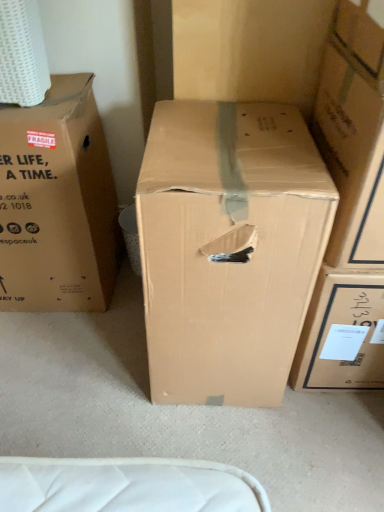
The width and height of the screenshot is (384, 512). Identify the location of brown cardboard box at center, which is the 2th box from right to left. (229, 248).

Identify the location of brown cardboard box at left, which is the 3th box from right to left. Image resolution: width=384 pixels, height=512 pixels. (57, 203).

The image size is (384, 512). What are the coordinates of `cardboard box at center, the 1th box viewed from the right` in the screenshot? It's located at (353, 134).

The width and height of the screenshot is (384, 512). I want to click on brown cardboard box at center, positioned as the second box in left-to-right order, so click(x=229, y=248).

From a real-world perspective, between cardboard box at center, which appears as the 3th box when viewed from the left, and brown cardboard box at center, positioned as the second box in left-to-right order, who is vertically lower?

In real-world perspective, brown cardboard box at center, positioned as the second box in left-to-right order, is lower.

Is point (380, 162) behind point (175, 336)?

No, (380, 162) is in front of (175, 336).

Is cardboard box at center, which appears as the 3th box when viewed from the left, looking in the opposite direction of brown cardboard box at center, which is the 2th box from right to left?

No.

Is the surface of cardboard box at center, which appears as the 3th box when viewed from the left, in direct contact with brown cardboard box at center, which is the 2th box from right to left?

No, cardboard box at center, which appears as the 3th box when viewed from the left, is not in contact with brown cardboard box at center, which is the 2th box from right to left.

From the image's perspective, between brown cardboard box at center, positioned as the second box in left-to-right order, and brown cardboard box at left, positioned as the 1th box in left-to-right order, which one is located above?

brown cardboard box at left, positioned as the 1th box in left-to-right order, appears higher in the image.

Is brown cardboard box at center, positioned as the second box in left-to-right order, taller than brown cardboard box at left, positioned as the 1th box in left-to-right order?

Yes, brown cardboard box at center, positioned as the second box in left-to-right order, is taller than brown cardboard box at left, positioned as the 1th box in left-to-right order.

Which object is positioned more to the left, brown cardboard box at center, which is the 2th box from right to left, or brown cardboard box at left, which is the 3th box from right to left?

From the viewer's perspective, brown cardboard box at left, which is the 3th box from right to left, appears more on the left side.

From the picture: Is brown cardboard box at center, which is the 2th box from right to left, aimed at brown cardboard box at left, positioned as the 1th box in left-to-right order?

No, brown cardboard box at center, which is the 2th box from right to left, does not turn towards brown cardboard box at left, positioned as the 1th box in left-to-right order.

Is brown cardboard box at left, positioned as the 1th box in left-to-right order, not inside brown cardboard box at center, positioned as the second box in left-to-right order?

Yes, brown cardboard box at left, positioned as the 1th box in left-to-right order, is outside of brown cardboard box at center, positioned as the second box in left-to-right order.

Considering the sizes of brown cardboard box at left, positioned as the 1th box in left-to-right order, and brown cardboard box at center, which is the 2th box from right to left, in the image, is brown cardboard box at left, positioned as the 1th box in left-to-right order, taller or shorter than brown cardboard box at center, which is the 2th box from right to left,?

Clearly, brown cardboard box at left, positioned as the 1th box in left-to-right order, is shorter compared to brown cardboard box at center, which is the 2th box from right to left.

Is brown cardboard box at left, which is the 3th box from right to left, far away from brown cardboard box at center, positioned as the second box in left-to-right order?

No, brown cardboard box at left, which is the 3th box from right to left, is in close proximity to brown cardboard box at center, positioned as the second box in left-to-right order.

Between brown cardboard box at left, positioned as the 1th box in left-to-right order, and brown cardboard box at center, positioned as the second box in left-to-right order, which one appears on the right side from the viewer's perspective?

From the viewer's perspective, brown cardboard box at center, positioned as the second box in left-to-right order, appears more on the right side.

Where is `the 2nd box directly above the brown cardboard box at center, positioned as the second box in left-to-right order (from a real-world perspective)`? This screenshot has height=512, width=384. the 2nd box directly above the brown cardboard box at center, positioned as the second box in left-to-right order (from a real-world perspective) is located at coordinates [353, 134].

Is brown cardboard box at center, positioned as the second box in left-to-right order, not inside cardboard box at center, which appears as the 3th box when viewed from the left?

Yes.

Looking at their sizes, would you say brown cardboard box at center, positioned as the second box in left-to-right order, is wider or thinner than cardboard box at center, the 1th box viewed from the right?

Clearly, brown cardboard box at center, positioned as the second box in left-to-right order, has more width compared to cardboard box at center, the 1th box viewed from the right.

Considering the sizes of objects brown cardboard box at center, positioned as the second box in left-to-right order, and cardboard box at center, the 1th box viewed from the right, in the image provided, who is shorter, brown cardboard box at center, positioned as the second box in left-to-right order, or cardboard box at center, the 1th box viewed from the right,?

With less height is cardboard box at center, the 1th box viewed from the right.

Is cardboard box at center, the 1th box viewed from the right, oriented towards brown cardboard box at left, positioned as the 1th box in left-to-right order?

No, cardboard box at center, the 1th box viewed from the right, is not facing towards brown cardboard box at left, positioned as the 1th box in left-to-right order.

Can you tell me how much cardboard box at center, which appears as the 3th box when viewed from the left, and brown cardboard box at left, which is the 3th box from right to left, differ in facing direction?

cardboard box at center, which appears as the 3th box when viewed from the left, and brown cardboard box at left, which is the 3th box from right to left, are facing 1.51 degrees away from each other.

Is cardboard box at center, the 1th box viewed from the right, located outside brown cardboard box at left, which is the 3th box from right to left?

Yes, cardboard box at center, the 1th box viewed from the right, is not within brown cardboard box at left, which is the 3th box from right to left.

Between cardboard box at center, the 1th box viewed from the right, and brown cardboard box at left, positioned as the 1th box in left-to-right order, which one has more height?

With more height is brown cardboard box at left, positioned as the 1th box in left-to-right order.

Could you tell me if brown cardboard box at left, positioned as the 1th box in left-to-right order, is turned towards cardboard box at center, the 1th box viewed from the right?

No, brown cardboard box at left, positioned as the 1th box in left-to-right order, is not oriented towards cardboard box at center, the 1th box viewed from the right.

Between brown cardboard box at left, positioned as the 1th box in left-to-right order, and cardboard box at center, the 1th box viewed from the right, which one has more height?

Standing taller between the two is brown cardboard box at left, positioned as the 1th box in left-to-right order.

From a real-world perspective, is brown cardboard box at left, which is the 3th box from right to left, below cardboard box at center, the 1th box viewed from the right?

Correct, in the physical world, brown cardboard box at left, which is the 3th box from right to left, is lower than cardboard box at center, the 1th box viewed from the right.

Where is `the 2nd box below the cardboard box at center, the 1th box viewed from the right (from a real-world perspective)`? The image size is (384, 512). the 2nd box below the cardboard box at center, the 1th box viewed from the right (from a real-world perspective) is located at coordinates (229, 248).

From a real-world perspective, which box is the 1st one above the brown cardboard box at center, positioned as the second box in left-to-right order? Please provide its 2D coordinates.

[(57, 203)]

Based on their spatial positions, is brown cardboard box at left, positioned as the 1th box in left-to-right order, or brown cardboard box at center, positioned as the second box in left-to-right order, closer to cardboard box at center, which appears as the 3th box when viewed from the left?

brown cardboard box at center, positioned as the second box in left-to-right order, lies closer to cardboard box at center, which appears as the 3th box when viewed from the left, than the other object.

When comparing their distances from brown cardboard box at left, positioned as the 1th box in left-to-right order, does cardboard box at center, the 1th box viewed from the right, or brown cardboard box at center, which is the 2th box from right to left, seem further?

The object further to brown cardboard box at left, positioned as the 1th box in left-to-right order, is cardboard box at center, the 1th box viewed from the right.

Looking at the image, which one is located closer to brown cardboard box at left, which is the 3th box from right to left, brown cardboard box at center, which is the 2th box from right to left, or cardboard box at center, the 1th box viewed from the right?

brown cardboard box at center, which is the 2th box from right to left, is positioned closer to the anchor brown cardboard box at left, which is the 3th box from right to left.

Which object lies further to the anchor point brown cardboard box at center, positioned as the second box in left-to-right order, cardboard box at center, which appears as the 3th box when viewed from the left, or brown cardboard box at left, positioned as the 1th box in left-to-right order?

brown cardboard box at left, positioned as the 1th box in left-to-right order, lies further to brown cardboard box at center, positioned as the second box in left-to-right order, than the other object.

Looking at this image, when comparing their distances from cardboard box at center, the 1th box viewed from the right, does brown cardboard box at center, which is the 2th box from right to left, or brown cardboard box at left, positioned as the 1th box in left-to-right order, seem closer?

Based on the image, brown cardboard box at center, which is the 2th box from right to left, appears to be nearer to cardboard box at center, the 1th box viewed from the right.

Looking at the image, which one is located further to brown cardboard box at center, positioned as the second box in left-to-right order, brown cardboard box at left, positioned as the 1th box in left-to-right order, or cardboard box at center, which appears as the 3th box when viewed from the left?

brown cardboard box at left, positioned as the 1th box in left-to-right order, lies further to brown cardboard box at center, positioned as the second box in left-to-right order, than the other object.

At what (x,y) coordinates should I click in order to perform the action: click on box between brown cardboard box at left, which is the 3th box from right to left, and cardboard box at center, which appears as the 3th box when viewed from the left. Please return your answer as a coordinate pair (x, y). Looking at the image, I should click on (229, 248).